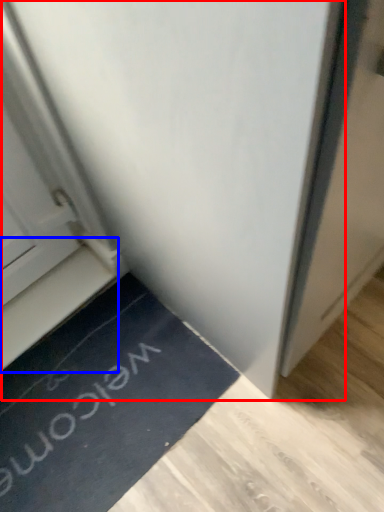
Question: Which of the following is the farthest to the observer, door (highlighted by a red box) or stairwell (highlighted by a blue box)?

Choices:
 (A) door
 (B) stairwell

Answer: (B)